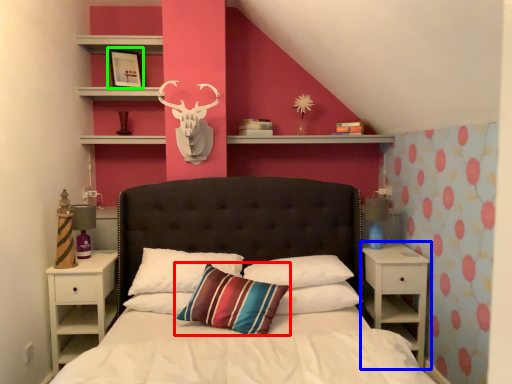
Question: Considering the real-world distances, which object is farthest from pillow (highlighted by a red box)? nightstand (highlighted by a blue box) or picture frame (highlighted by a green box)?

Choices:
 (A) nightstand
 (B) picture frame

Answer: (B)